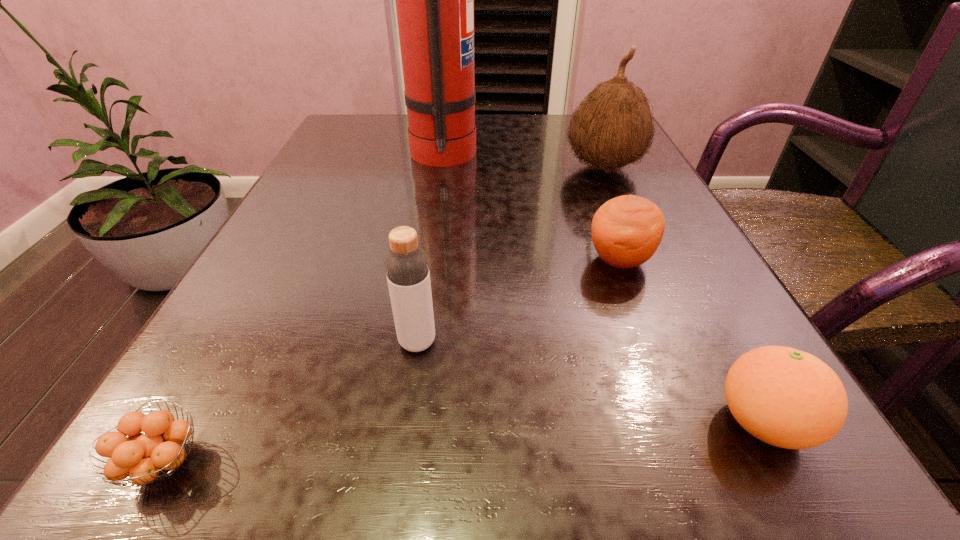
Find the location of a particular element. free space located 0.380m on the surface of the second tallest object is located at coordinates 375,167.

Find the location of a particular element. The image size is (960, 540). vacant space located on the right of the fourth shortest object is located at coordinates (629, 342).

At what (x,y) coordinates should I click in order to perform the action: click on free location located 0.320m on the left of the fourth nearest object. Please return your answer as a coordinate pair (x, y). Looking at the image, I should click on (375, 260).

Where is `vacant space located 0.080m on the right of the leftmost object`? vacant space located 0.080m on the right of the leftmost object is located at coordinates (288, 462).

Identify the location of fire extinguisher that is positioned at the far edge. This screenshot has height=540, width=960. (434, 0).

You are a GUI agent. You are given a task and a screenshot of the screen. Output one action in this format:
    pyautogui.click(x=<x>, y=<y>)
    Task: Click on the coconut located in the far edge section of the desktop
    This screenshot has width=960, height=540.
    Given the screenshot: What is the action you would take?
    pyautogui.click(x=612, y=128)

Where is `object that is at the left edge`? object that is at the left edge is located at coordinates (154, 454).

Find the location of a particular element. This screenshot has height=540, width=960. coconut that is at the right edge is located at coordinates (612, 128).

Locate an element on the screen. This screenshot has height=540, width=960. object that is at the near left corner is located at coordinates (154, 454).

At what (x,y) coordinates should I click in order to perform the action: click on object at the far right corner. Please return your answer as a coordinate pair (x, y). Looking at the image, I should click on (612, 128).